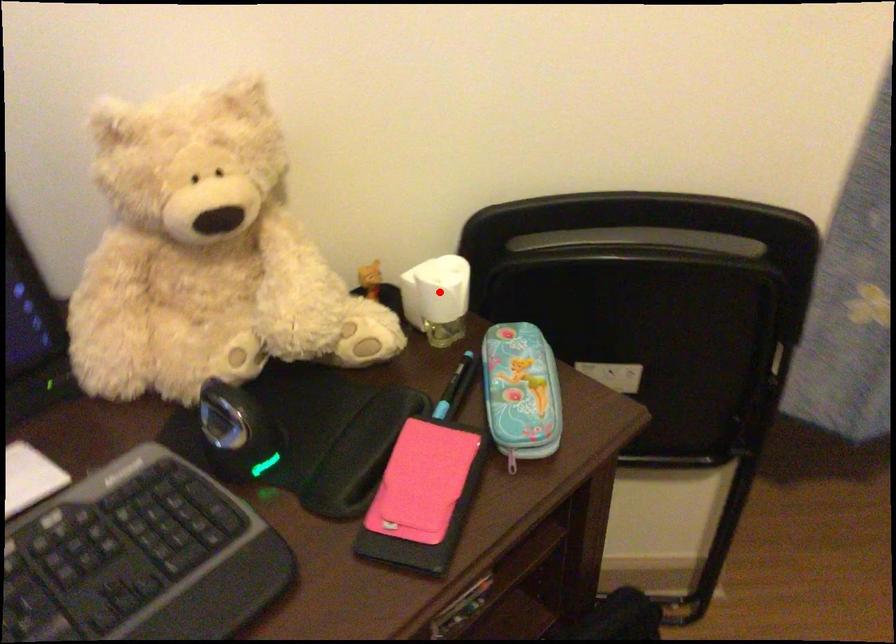
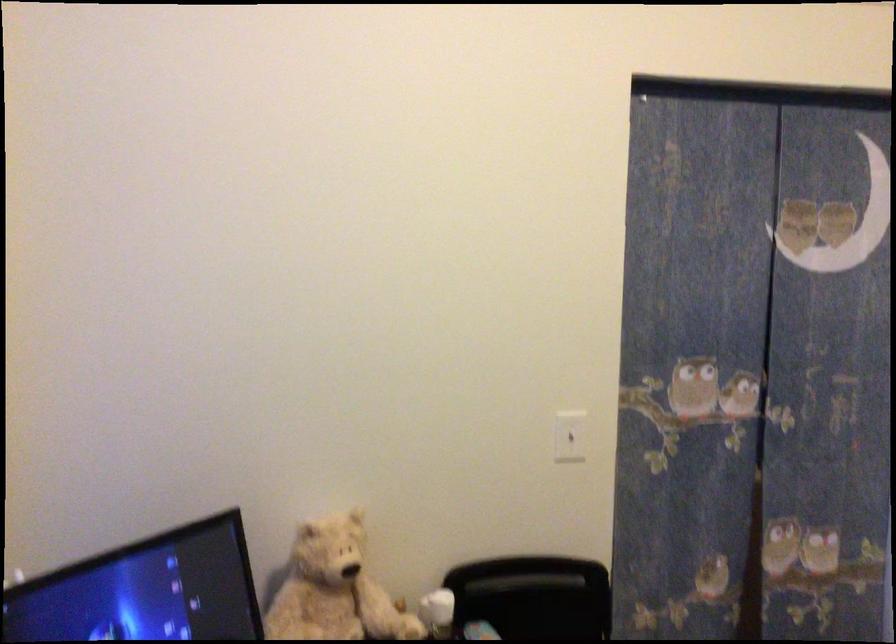
Question: I am providing you with two images of the same scene from different viewpoints. Given a red point in image1, look at the same physical point in image2. Is it:

Choices:
 (A) Closer to the viewpoint
 (B) Farther from the viewpoint

Answer: (B)